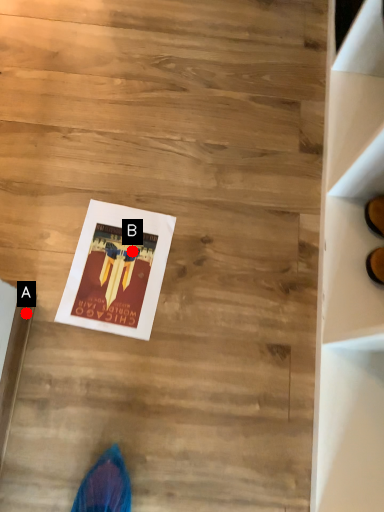
Question: Two points are circled on the image, labeled by A and B beside each circle. Which point is closer to the camera taking this photo?

Choices:
 (A) A is closer
 (B) B is closer

Answer: (A)